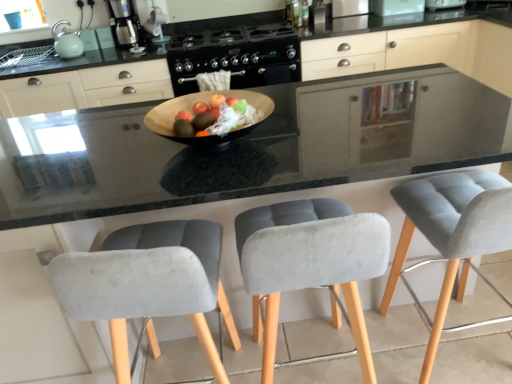
What do you see at coordinates (124, 23) in the screenshot? The height and width of the screenshot is (384, 512). I see `satin silver coffee maker at upper left` at bounding box center [124, 23].

Find the location of `black matte gas stove at center`. black matte gas stove at center is located at coordinates (236, 56).

What is the approximate width of white glossy coffee maker at upper center, the fourth appliance in the right-to-left sequence?

white glossy coffee maker at upper center, the fourth appliance in the right-to-left sequence, is 7.66 inches wide.

At what (x,y) coordinates should I click in order to perform the action: click on brushed metal toaster at upper center, which ranks as the third appliance in left-to-right order. Please return your answer as a coordinate pair (x, y). The height and width of the screenshot is (384, 512). Looking at the image, I should click on (349, 15).

How much space does brushed metal toaster at upper center, the first appliance when ordered from right to left, occupy vertically?

brushed metal toaster at upper center, the first appliance when ordered from right to left, is 3.87 inches tall.

In order to face brushed metal toaster at upper center, positioned as the 5th appliance in left-to-right order, should I rotate leftwards or rightwards?

Turn right by 24.027 degrees to look at brushed metal toaster at upper center, positioned as the 5th appliance in left-to-right order.

In order to click on satin silver coffee maker at upper left in this screenshot , I will do `click(124, 23)`.

Considering the relative sizes of satin silver coffee maker at upper left and brushed metal toaster at upper center, which ranks as the third appliance in left-to-right order, in the image provided, is satin silver coffee maker at upper left taller than brushed metal toaster at upper center, which ranks as the third appliance in left-to-right order,?

Yes.

Does satin silver coffee maker at upper left turn towards brushed metal toaster at upper center, which is counted as the 3th appliance, starting from the right?

No, satin silver coffee maker at upper left does not turn towards brushed metal toaster at upper center, which is counted as the 3th appliance, starting from the right.

Can you confirm if satin silver coffee maker at upper left is positioned to the right of brushed metal toaster at upper center, which is counted as the 3th appliance, starting from the right?

Incorrect, satin silver coffee maker at upper left is not on the right side of brushed metal toaster at upper center, which is counted as the 3th appliance, starting from the right.

From a real-world perspective, which is physically below, satin silver coffee maker at upper left or brushed metal toaster at upper center, which is counted as the 3th appliance, starting from the right?

brushed metal toaster at upper center, which is counted as the 3th appliance, starting from the right, is physically lower.

From a real-world perspective, is satin silver coffee maker at upper left below gray fabric chair at center, the 3th chair viewed from the right?

No, from a real-world perspective, satin silver coffee maker at upper left is not under gray fabric chair at center, the 3th chair viewed from the right.

Considering the relative positions of satin silver coffee maker at upper left and gray fabric chair at center, the 3th chair viewed from the right, in the image provided, is satin silver coffee maker at upper left behind gray fabric chair at center, the 3th chair viewed from the right,?

Yes, satin silver coffee maker at upper left is further from the camera.

From the image's perspective, is satin silver coffee maker at upper left above or below gray fabric chair at center, the 3th chair viewed from the right?

satin silver coffee maker at upper left is situated higher than gray fabric chair at center, the 3th chair viewed from the right, in the image.

Is satin silver coffee maker at upper left thinner than gray fabric chair at center, the 3th chair viewed from the right?

Correct, the width of satin silver coffee maker at upper left is less than that of gray fabric chair at center, the 3th chair viewed from the right.

Which is closer to the camera, [408,237] or [461,7]?

Point [408,237] is closer to the camera than point [461,7].

Consider the image. Between velvet grey bar stool at right, marked as the first chair in a right-to-left arrangement, and brushed metal toaster at upper center, positioned as the 5th appliance in left-to-right order, which one has larger width?

velvet grey bar stool at right, marked as the first chair in a right-to-left arrangement, is wider.

Is velvet grey bar stool at right, marked as the first chair in a right-to-left arrangement, at the left side of brushed metal toaster at upper center, the first appliance when ordered from right to left?

Indeed, velvet grey bar stool at right, marked as the first chair in a right-to-left arrangement, is positioned on the left side of brushed metal toaster at upper center, the first appliance when ordered from right to left.

Between velvet grey bar stool at right, the 3th chair positioned from the left, and brushed metal toaster at upper center, the first appliance when ordered from right to left, which one has less height?

Standing shorter between the two is brushed metal toaster at upper center, the first appliance when ordered from right to left.

From the image's perspective, between brushed metal toaster at upper center, positioned as the 5th appliance in left-to-right order, and white glossy microwave at upper center, the second appliance viewed from the right, which one is located above?

brushed metal toaster at upper center, positioned as the 5th appliance in left-to-right order, from the image's perspective.

Which is more to the right, brushed metal toaster at upper center, positioned as the 5th appliance in left-to-right order, or white glossy microwave at upper center, the second appliance viewed from the right?

Answer: brushed metal toaster at upper center, positioned as the 5th appliance in left-to-right order.

Considering the sizes of brushed metal toaster at upper center, positioned as the 5th appliance in left-to-right order, and white glossy microwave at upper center, the fourth appliance positioned from the left, in the image, is brushed metal toaster at upper center, positioned as the 5th appliance in left-to-right order, taller or shorter than white glossy microwave at upper center, the fourth appliance positioned from the left,?

In the image, brushed metal toaster at upper center, positioned as the 5th appliance in left-to-right order, appears to be shorter than white glossy microwave at upper center, the fourth appliance positioned from the left.

Considering the relative sizes of brushed metal toaster at upper center, the first appliance when ordered from right to left, and white glossy microwave at upper center, the fourth appliance positioned from the left, in the image provided, is brushed metal toaster at upper center, the first appliance when ordered from right to left, thinner than white glossy microwave at upper center, the fourth appliance positioned from the left,?

Yes, brushed metal toaster at upper center, the first appliance when ordered from right to left, is thinner than white glossy microwave at upper center, the fourth appliance positioned from the left.

From the image's perspective, is brushed metal toaster at upper center, positioned as the 5th appliance in left-to-right order, beneath brushed metal toaster at upper center, which ranks as the third appliance in left-to-right order?

Correct, brushed metal toaster at upper center, positioned as the 5th appliance in left-to-right order, appears lower than brushed metal toaster at upper center, which ranks as the third appliance in left-to-right order, in the image.

Is point (436, 2) positioned behind point (362, 6)?

No.

Considering the sizes of objects brushed metal toaster at upper center, positioned as the 5th appliance in left-to-right order, and brushed metal toaster at upper center, which ranks as the third appliance in left-to-right order, in the image provided, who is smaller, brushed metal toaster at upper center, positioned as the 5th appliance in left-to-right order, or brushed metal toaster at upper center, which ranks as the third appliance in left-to-right order,?

brushed metal toaster at upper center, which ranks as the third appliance in left-to-right order, is smaller.

From a real-world perspective, is brushed metal toaster at upper center, the first appliance when ordered from right to left, positioned over brushed metal toaster at upper center, which ranks as the third appliance in left-to-right order, based on gravity?

Actually, brushed metal toaster at upper center, the first appliance when ordered from right to left, is physically below brushed metal toaster at upper center, which ranks as the third appliance in left-to-right order, in the real world.

Which of these two, white glossy coffee maker at upper center, the fourth appliance in the right-to-left sequence, or velvet grey bar stool at right, the 3th chair positioned from the left, stands taller?

Standing taller between the two is velvet grey bar stool at right, the 3th chair positioned from the left.

Is the depth of white glossy coffee maker at upper center, the second appliance positioned from the left, greater than that of velvet grey bar stool at right, marked as the first chair in a right-to-left arrangement?

Yes, it is.

Based on the photo, is white glossy coffee maker at upper center, the fourth appliance in the right-to-left sequence, far from velvet grey bar stool at right, the 3th chair positioned from the left?

white glossy coffee maker at upper center, the fourth appliance in the right-to-left sequence, is far away from velvet grey bar stool at right, the 3th chair positioned from the left.

Is white glossy coffee maker at upper center, the fourth appliance in the right-to-left sequence, wider or thinner than velvet grey bar stool at right, marked as the first chair in a right-to-left arrangement?

In the image, white glossy coffee maker at upper center, the fourth appliance in the right-to-left sequence, appears to be more narrow than velvet grey bar stool at right, marked as the first chair in a right-to-left arrangement.

Is the surface of white glossy coffee maker at upper center, the second appliance positioned from the left, in direct contact with white glossy microwave at upper center, the second appliance viewed from the right?

No, white glossy coffee maker at upper center, the second appliance positioned from the left, is not touching white glossy microwave at upper center, the second appliance viewed from the right.

You are a GUI agent. You are given a task and a screenshot of the screen. Output one action in this format:
    pyautogui.click(x=<x>, y=<y>)
    Task: Click on the appliance that is the 2nd one when counting rightward from the white glossy coffee maker at upper center, the fourth appliance in the right-to-left sequence
    Image resolution: width=512 pixels, height=384 pixels.
    Given the screenshot: What is the action you would take?
    pyautogui.click(x=396, y=7)

Can you confirm if white glossy coffee maker at upper center, the fourth appliance in the right-to-left sequence, is shorter than white glossy microwave at upper center, the second appliance viewed from the right?

In fact, white glossy coffee maker at upper center, the fourth appliance in the right-to-left sequence, may be taller than white glossy microwave at upper center, the second appliance viewed from the right.

From a real-world perspective, is white glossy coffee maker at upper center, the second appliance positioned from the left, beneath white glossy microwave at upper center, the second appliance viewed from the right?

No, from a real-world perspective, white glossy coffee maker at upper center, the second appliance positioned from the left, is not beneath white glossy microwave at upper center, the second appliance viewed from the right.

What are the coordinates of `the 2nd appliance counting from the right side of the satin silver coffee maker at upper left` in the screenshot? It's located at point(349,15).

You are a GUI agent. You are given a task and a screenshot of the screen. Output one action in this format:
    pyautogui.click(x=<x>, y=<y>)
    Task: Click on the kitchen appliance that appears on the left of gray fabric chair at center, arranged as the 1th chair when viewed from the left
    The width and height of the screenshot is (512, 384).
    Given the screenshot: What is the action you would take?
    pyautogui.click(x=124, y=23)

Looking at the image, which one is located further to black matte gas stove at center, velvet grey bar stool at right, marked as the first chair in a right-to-left arrangement, or matte green kettle at upper left, which is counted as the 5th appliance, starting from the right?

velvet grey bar stool at right, marked as the first chair in a right-to-left arrangement, is positioned further to the anchor black matte gas stove at center.

Based on their spatial positions, is brushed metal toaster at upper center, which is counted as the 3th appliance, starting from the right, or white glossy coffee maker at upper center, the second appliance positioned from the left, further from velvet grey bar stool at right, the 3th chair positioned from the left?

white glossy coffee maker at upper center, the second appliance positioned from the left, is further to velvet grey bar stool at right, the 3th chair positioned from the left.

Estimate the real-world distances between objects in this image. Which object is further from white glossy coffee maker at upper center, the second appliance positioned from the left, matte green kettle at upper left, which is counted as the 5th appliance, starting from the right, or white glossy microwave at upper center, the second appliance viewed from the right?

white glossy microwave at upper center, the second appliance viewed from the right.

From the image, which object appears to be nearer to velvet grey chair at center, positioned as the second chair in right-to-left order, white glossy coffee maker at upper center, the fourth appliance in the right-to-left sequence, or white glossy microwave at upper center, the fourth appliance positioned from the left?

white glossy microwave at upper center, the fourth appliance positioned from the left.

Based on their spatial positions, is gray fabric chair at center, the 3th chair viewed from the right, or velvet grey bar stool at right, the 3th chair positioned from the left, closer to brushed metal toaster at upper center, which ranks as the third appliance in left-to-right order?

velvet grey bar stool at right, the 3th chair positioned from the left, is closer to brushed metal toaster at upper center, which ranks as the third appliance in left-to-right order.

Which object lies further to the anchor point velvet grey chair at center, positioned as the second chair in right-to-left order, brushed metal toaster at upper center, the first appliance when ordered from right to left, or brushed metal toaster at upper center, which ranks as the third appliance in left-to-right order?

brushed metal toaster at upper center, the first appliance when ordered from right to left, is further to velvet grey chair at center, positioned as the second chair in right-to-left order.

From the image, which object appears to be farther from white glossy coffee maker at upper center, the second appliance positioned from the left, brushed metal toaster at upper center, positioned as the 5th appliance in left-to-right order, or velvet grey chair at center, positioned as the 2th chair in left-to-right order?

velvet grey chair at center, positioned as the 2th chair in left-to-right order, is positioned further to the anchor white glossy coffee maker at upper center, the second appliance positioned from the left.

From the image, which object appears to be nearer to matte green kettle at upper left, which is counted as the 5th appliance, starting from the right, white glossy coffee maker at upper center, the fourth appliance in the right-to-left sequence, or gray fabric chair at center, the 3th chair viewed from the right?

white glossy coffee maker at upper center, the fourth appliance in the right-to-left sequence, is closer to matte green kettle at upper left, which is counted as the 5th appliance, starting from the right.

Locate an element on the screen. gas stove between satin silver coffee maker at upper left and brushed metal toaster at upper center, the first appliance when ordered from right to left, in the horizontal direction is located at coordinates (236, 56).

What are the coordinates of `gas stove between gray fabric chair at center, the 3th chair viewed from the right, and satin silver coffee maker at upper left, along the z-axis` in the screenshot? It's located at (236, 56).

Find the location of a particular element. appliance located between white glossy coffee maker at upper center, the fourth appliance in the right-to-left sequence, and white glossy microwave at upper center, the fourth appliance positioned from the left, in the left-right direction is located at coordinates (349, 15).

Identify the location of kitchen appliance between velvet grey bar stool at right, the 3th chair positioned from the left, and brushed metal toaster at upper center, which ranks as the third appliance in left-to-right order, along the z-axis. This screenshot has height=384, width=512. (124, 23).